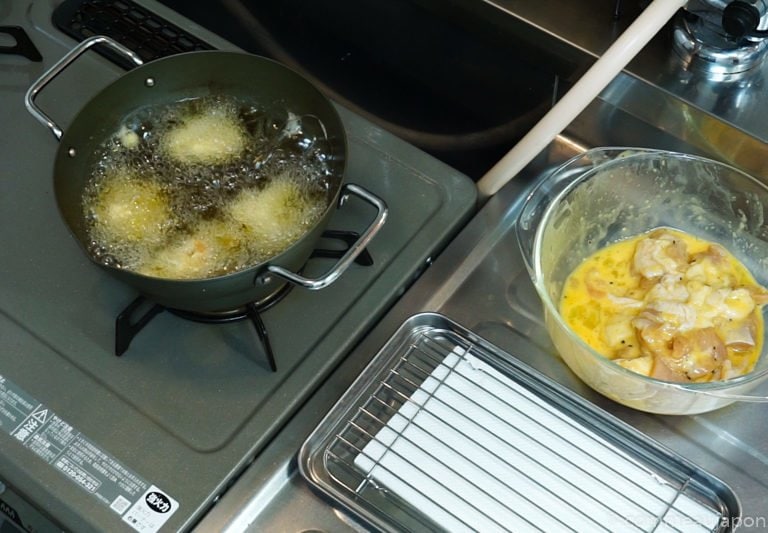
The height and width of the screenshot is (533, 768). I want to click on black pot handle rivets, so click(266, 282), click(349, 203), click(74, 153), click(151, 83).